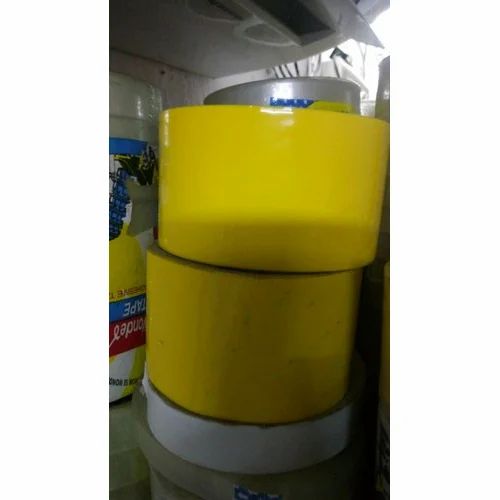
Identify the location of concrete wall. click(x=176, y=88).